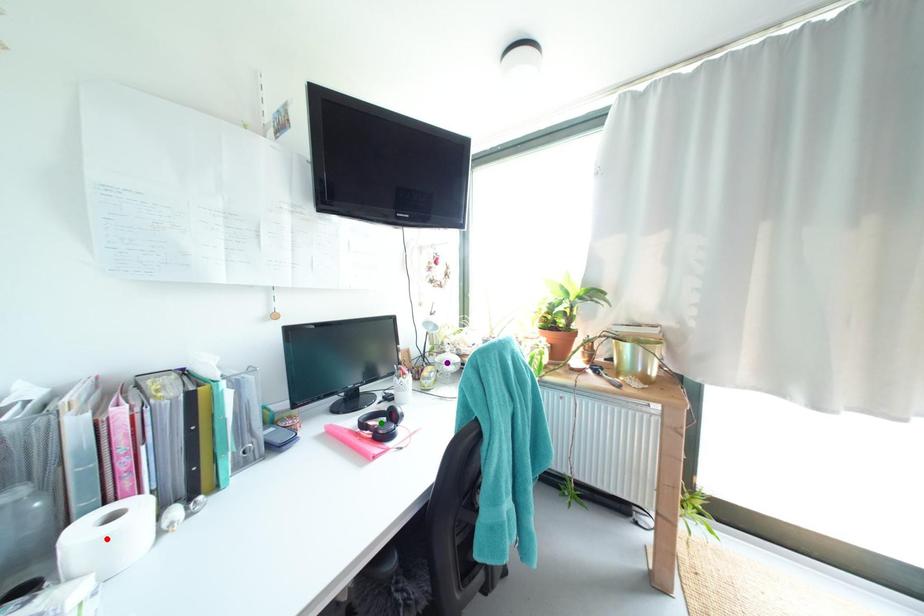
Order these from farthest to nearest:
A) purple point
B) red point
C) green point

purple point
green point
red point